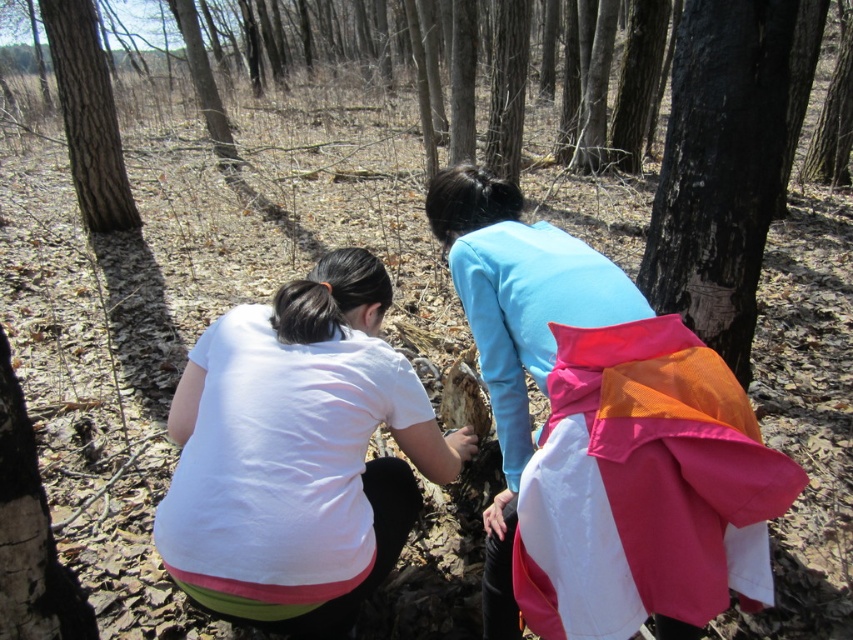
You are a hiker trying to identify the tallest tree in the area. Based on the scene, which object between the black rough bark at center and the rough bark tree at upper left would you consider the tallest?

The rough bark tree at upper left is taller than the black rough bark at center, so it is the tallest between the two.